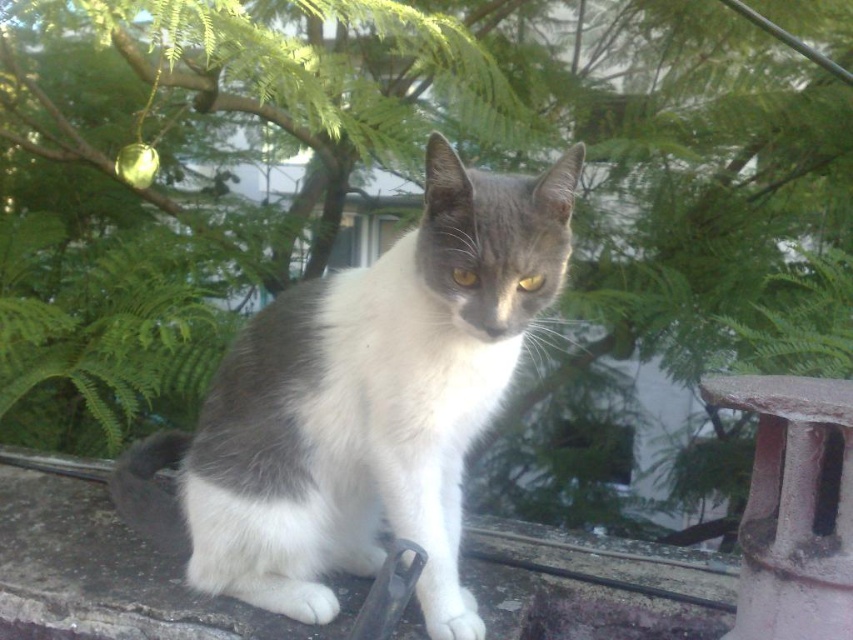
Between white-furred cat at center and gray concrete window sill at center, which one appears on the right side from the viewer's perspective?

From the viewer's perspective, gray concrete window sill at center appears more on the right side.

Is white-furred cat at center thinner than gray concrete window sill at center?

In fact, white-furred cat at center might be wider than gray concrete window sill at center.

What do you see at coordinates (363, 404) in the screenshot?
I see `white-furred cat at center` at bounding box center [363, 404].

Locate an element on the screen. Image resolution: width=853 pixels, height=640 pixels. white-furred cat at center is located at coordinates point(363,404).